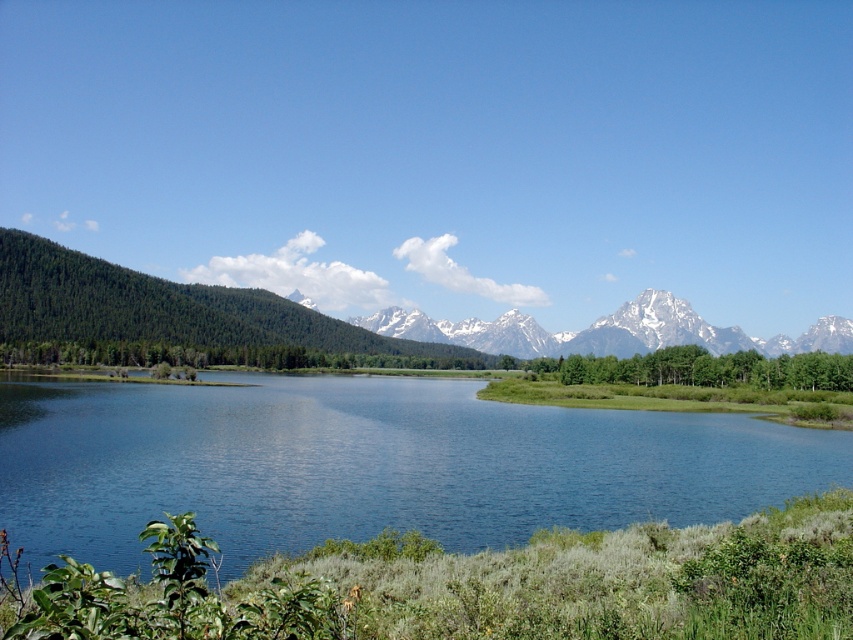
Question: Can you confirm if blue glassy water at center is positioned above green forested mountain range at upper left?

Choices:
 (A) no
 (B) yes

Answer: (A)

Question: Is blue glassy water at center below green forested mountain range at upper left?

Choices:
 (A) no
 (B) yes

Answer: (B)

Question: Among these objects, which one is farthest from the camera?

Choices:
 (A) blue glassy water at center
 (B) green forested mountain range at upper left

Answer: (B)

Question: Among these objects, which one is nearest to the camera?

Choices:
 (A) blue glassy water at center
 (B) green forested mountain range at upper left

Answer: (A)

Question: Is blue glassy water at center wider than green forested mountain range at upper left?

Choices:
 (A) yes
 (B) no

Answer: (B)